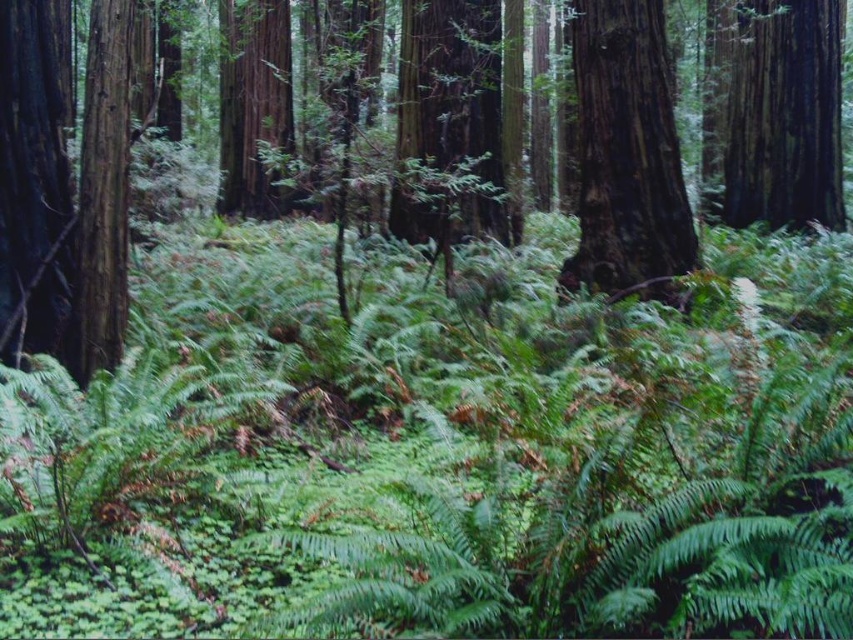
Is point (35, 131) farther from camera compared to point (840, 168)?

No.

Who is higher up, smooth bark tree at center or smooth dark brown tree trunk at upper right?

smooth dark brown tree trunk at upper right is above.

Who is more distant from viewer, [0,305] or [744,216]?

The point [744,216] is behind.

Find the location of a particular element. Image resolution: width=853 pixels, height=640 pixels. smooth bark tree at center is located at coordinates (33, 189).

Is smooth dark brown tree trunk at center smaller than smooth dark brown tree trunk at upper right?

Yes, smooth dark brown tree trunk at center is smaller than smooth dark brown tree trunk at upper right.

Measure the distance from smooth dark brown tree trunk at center to smooth dark brown tree trunk at upper right.

smooth dark brown tree trunk at center and smooth dark brown tree trunk at upper right are 7.35 meters apart.

Is point (647, 188) positioned after point (811, 120)?

No, it is in front of (811, 120).

Identify the location of smooth dark brown tree trunk at center. The image size is (853, 640). (625, 154).

Between smooth bark tree at center and smooth dark brown tree trunk at center, which one appears on the left side from the viewer's perspective?

From the viewer's perspective, smooth bark tree at center appears more on the left side.

Consider the image. Is smooth bark tree at center below smooth dark brown tree trunk at center?

No, smooth bark tree at center is not below smooth dark brown tree trunk at center.

Locate an element on the screen. The width and height of the screenshot is (853, 640). smooth bark tree at center is located at coordinates (33, 189).